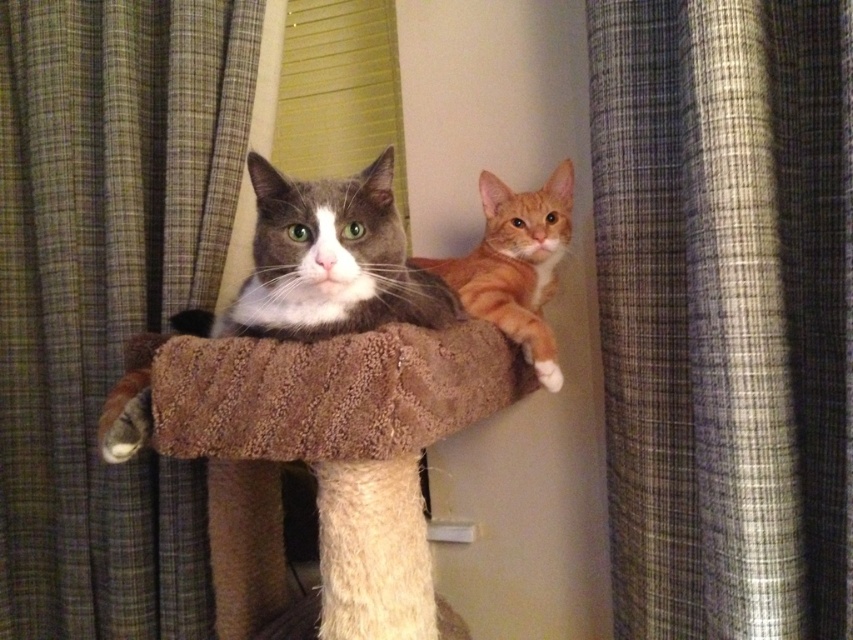
You are a photographer trying to capture both cats in a single shot. The camera is positioned at the front of the cat tree. Which cat is closer to the camera between the cat at point (405, 298) and the cat at point (553, 250)?

The cat at point (405, 298) is closer to the camera because it is in front of the cat at point (553, 250).

You are a cat owner who wants to place a new cat tree in your living room. The cat tree you want to buy is 1.2 meters wide. You see the green plaid curtain at left and the brown textured cat bed at center in the room. Will the cat tree fit between them without touching either?

The green plaid curtain at left has a lesser width compared to brown textured cat bed at center. Since the cat tree is 1.2 meters wide, but the exact distance between the curtain and the bed isn